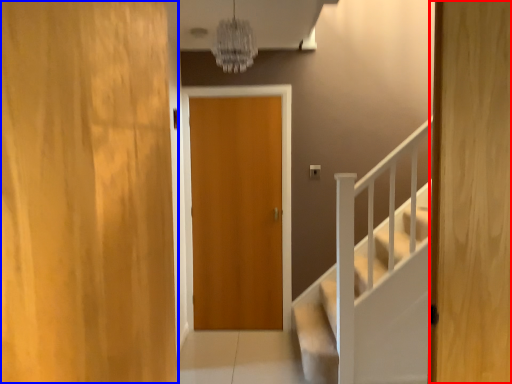
Question: Which object appears farthest to the camera in this image, door (highlighted by a red box) or door (highlighted by a blue box)?

Choices:
 (A) door
 (B) door

Answer: (A)